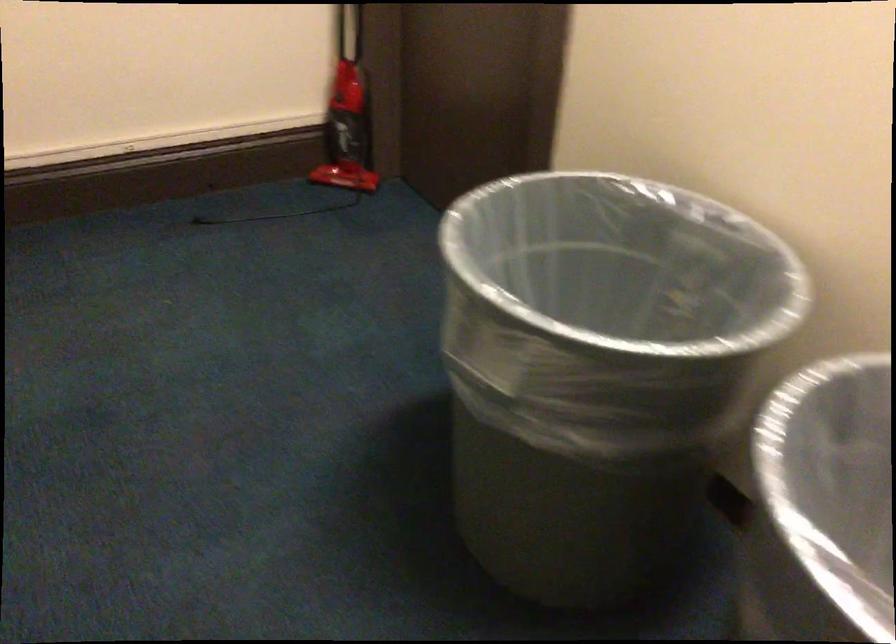
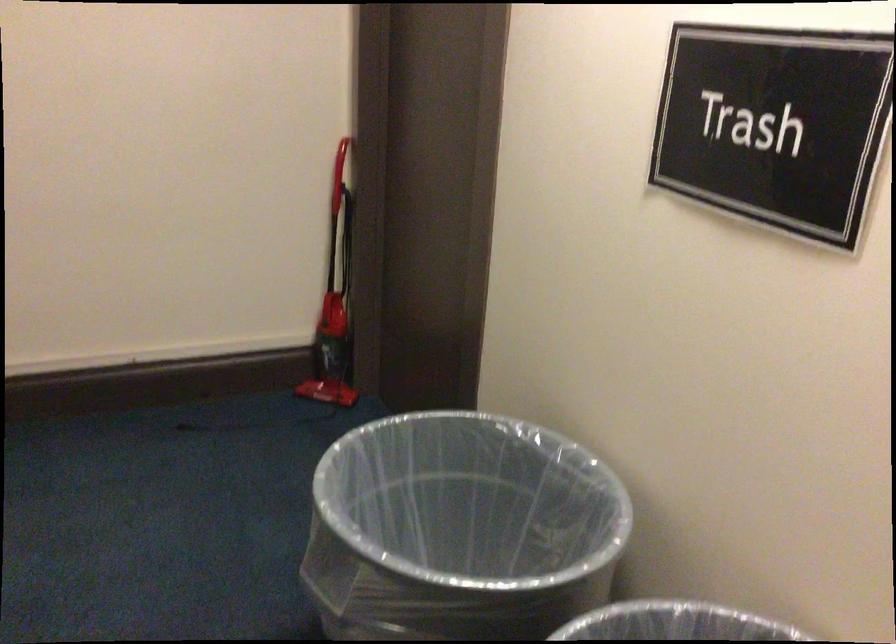
Where in the second image is the point corresponding to pixel 570 308 from the first image?

(460, 529)